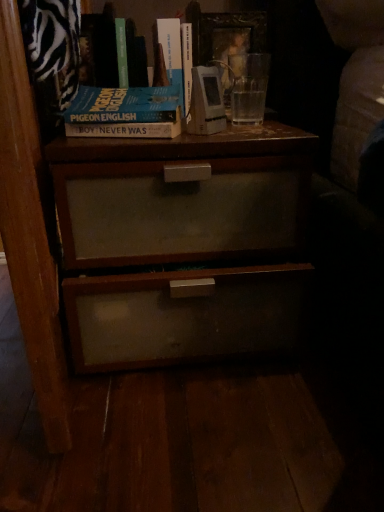
You are a GUI agent. You are given a task and a screenshot of the screen. Output one action in this format:
    pyautogui.click(x=<x>, y=<y>)
    Task: Click on the vacant area that is situated to the right of blue matte book at upper center
    This screenshot has width=384, height=512.
    Given the screenshot: What is the action you would take?
    pyautogui.click(x=235, y=131)